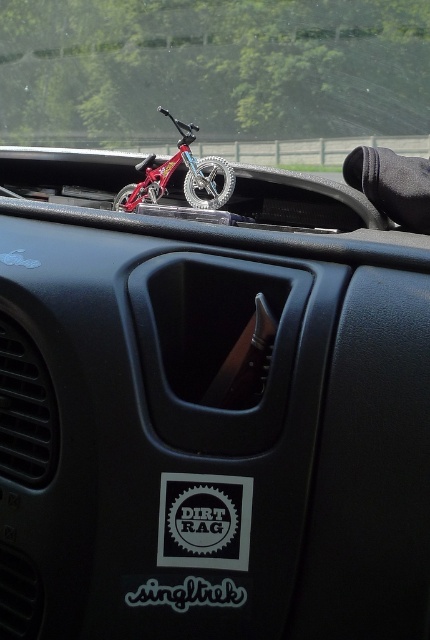
You are a passenger in a car and want to see the road ahead. The clear glass windshield at upper center and the metallic red bicycle at center are in your line of sight. Which object is bigger and might block your view more?

The clear glass windshield at upper center has a larger size compared to metallic red bicycle at center, so it might block your view more.

You are a passenger in the car and looking at the dashboard. There are two points marked on the dashboard. The first point is at coordinate point (x=122, y=92) and the second point is at coordinate point (x=226, y=202). Which point appears closer to you?

Point (x=122, y=92) is further to the camera than point (x=226, y=202), so the second point at (x=226, y=202) appears closer to you.

You are sitting in the driver seat of the car and looking forward. Which object is closer to you between the clear glass windshield at upper center and the metallic red bicycle at center?

The clear glass windshield at upper center is closer to you than the metallic red bicycle at center because it is further to the viewer.